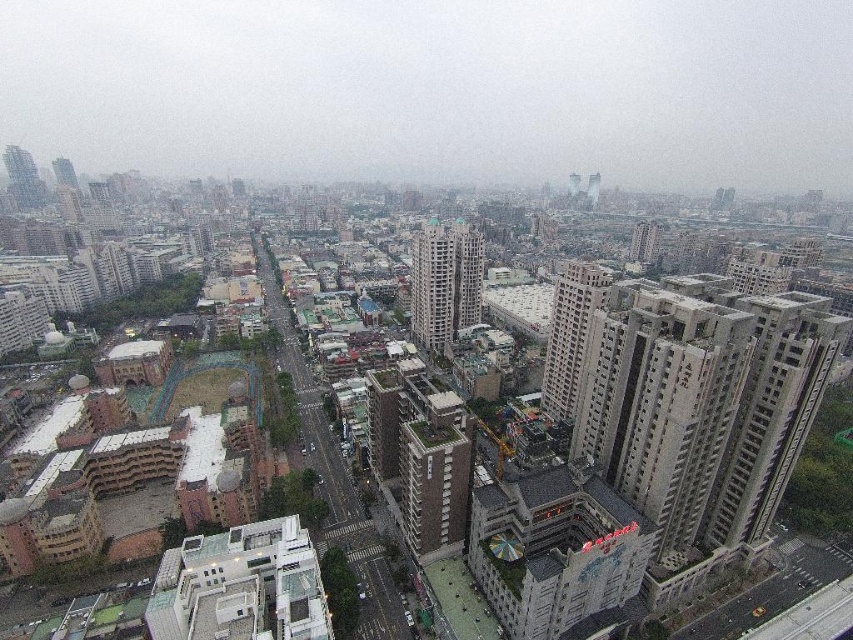
You are a drone operator planning to fly a drone from point A to point B in the city. The coordinates for point A are point (x=416, y=234) and point B are point (x=548, y=413). Considering the city layout described, will the drone have to fly over any tall buildings during its path from point A to point B?

Point (x=416, y=234) is behind point (x=548, y=413), so the drone will not have to fly over any tall buildings during its path from point A to point B.